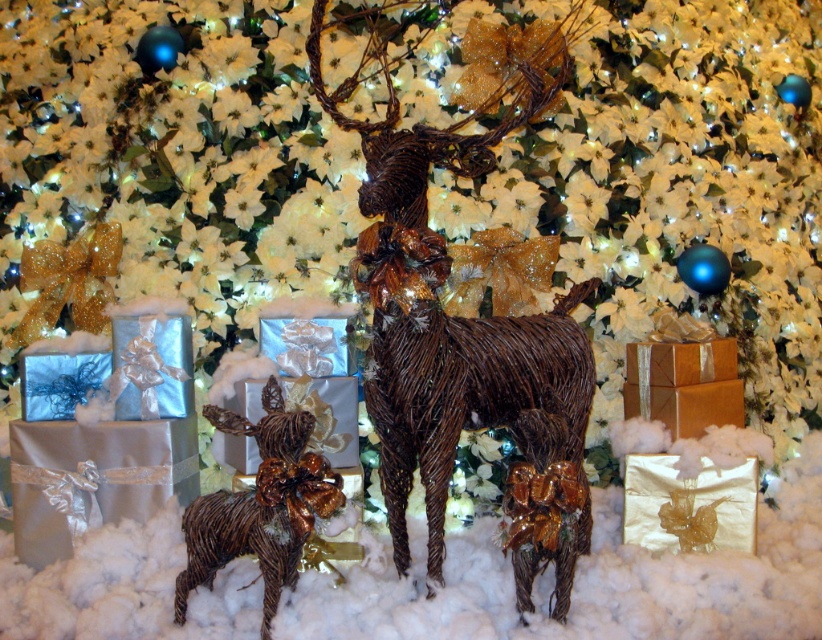
You are setting up a Christmas display and want to ensure the brown textured reindeer at center is visible. Is the shiny gold figurine at lower left blocking its view from the front?

The brown textured reindeer at center is in front of the shiny gold figurine at lower left, so the shiny gold figurine at lower left is not blocking its view from the front.

You are setting up a Christmas display and need to place a shiny gold figurine at lower left. You want to ensure it is positioned to the left of the brown textured reindeer at center. Is the current arrangement correct?

Yes, the current arrangement is correct because the brown textured reindeer at center is to the right of the shiny gold figurine at lower left, meaning the gold figurine is positioned to the left of the reindeer as desired.

From the picture: You are setting up a shelf for a Christmas display. You have a brown textured reindeer at center and a shiny gold figurine at lower left. Which one should you place first if you want to ensure there is enough space for both on the shelf?

The brown textured reindeer at center is wider than the shiny gold figurine at lower left, so you should place the brown textured reindeer at center first to ensure there is enough space for both on the shelf.